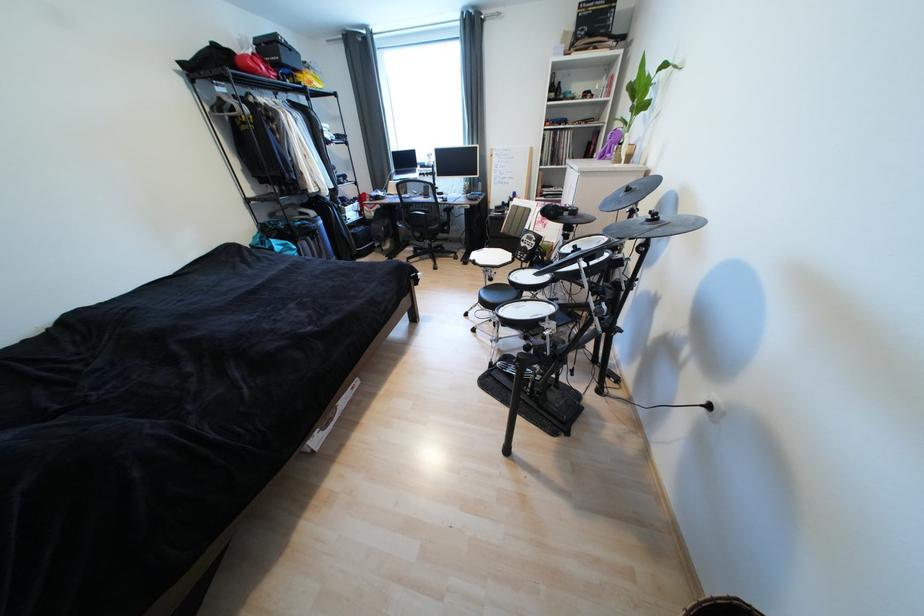
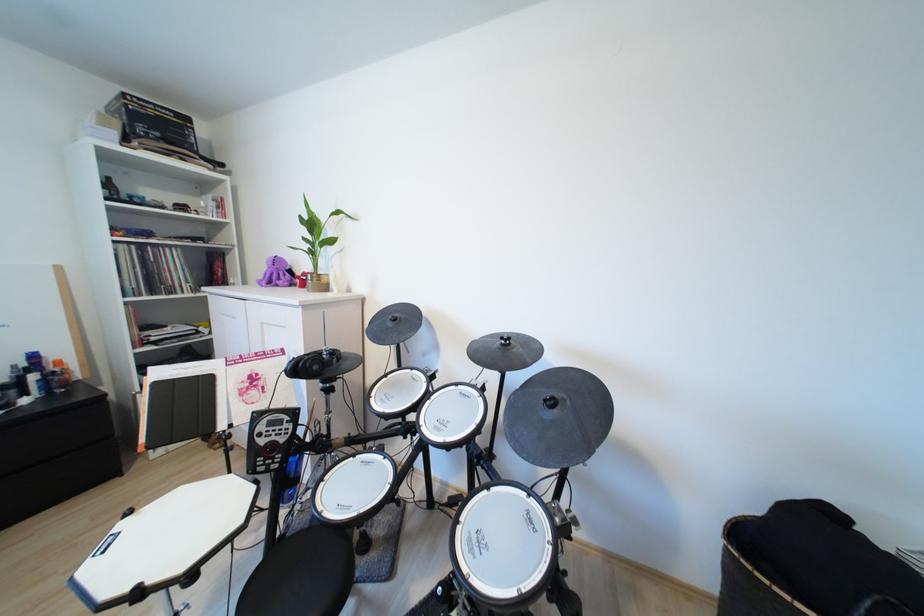
In the second image, find the point that corresponds to [655,222] in the first image.

(507, 346)